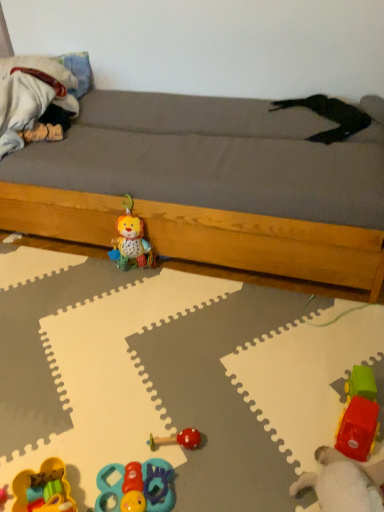
Where is `unoccupied area behind rubberized plastic truck at lower right, marked as the 1th toy in a right-to-left arrangement`? unoccupied area behind rubberized plastic truck at lower right, marked as the 1th toy in a right-to-left arrangement is located at coordinates (323, 361).